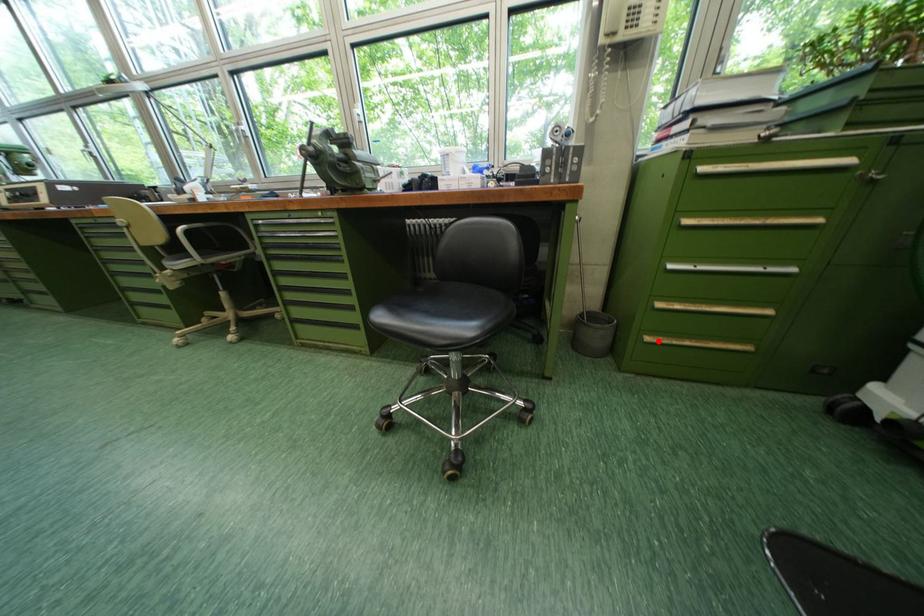
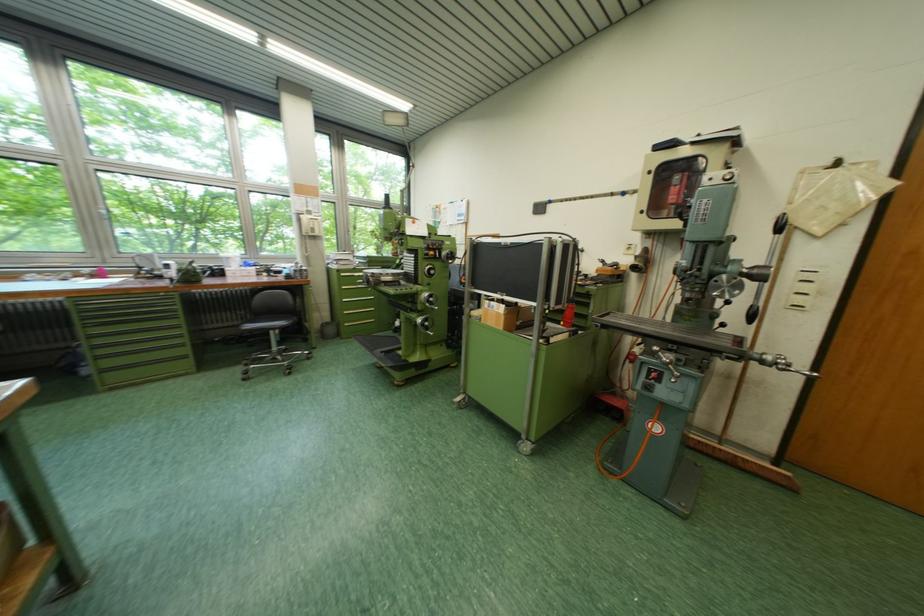
Find the pixel in the second image that matches the highlighted location in the first image.

(357, 326)